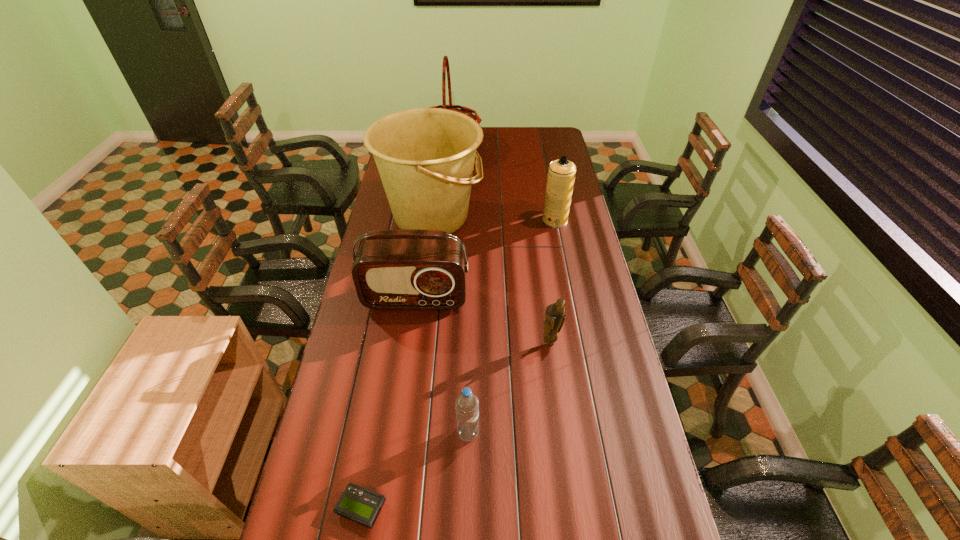
Image resolution: width=960 pixels, height=540 pixels. Identify the location of beeper at the left edge. (360, 505).

You are a GUI agent. You are given a task and a screenshot of the screen. Output one action in this format:
    pyautogui.click(x=<x>, y=<y>)
    Task: Click on the object that is at the right edge
    The height and width of the screenshot is (540, 960).
    Given the screenshot: What is the action you would take?
    pyautogui.click(x=561, y=174)

Locate an element on the screen. The width and height of the screenshot is (960, 540). object that is at the far left corner is located at coordinates (445, 67).

Locate an element on the screen. Image resolution: width=960 pixels, height=540 pixels. free space at the far edge of the desktop is located at coordinates (523, 147).

This screenshot has width=960, height=540. In the image, there is a desktop. Find the location of `vacant space at the left edge`. vacant space at the left edge is located at coordinates (348, 367).

Where is `free spot at the right edge of the desktop`? Image resolution: width=960 pixels, height=540 pixels. free spot at the right edge of the desktop is located at coordinates (596, 431).

Locate an element on the screen. This screenshot has width=960, height=540. empty space between the figurine and the basket is located at coordinates (499, 246).

Identify the location of free space between the radio receiver and the second nearest object. The image size is (960, 540). (442, 366).

Image resolution: width=960 pixels, height=540 pixels. Identify the location of vacant area that lies between the rightmost object and the bucket. (493, 219).

At what (x,y) coordinates should I click in order to perform the action: click on vacant point located between the water bottle and the sixth object from left to right. Please return your answer as a coordinate pair (x, y). Looking at the image, I should click on 509,388.